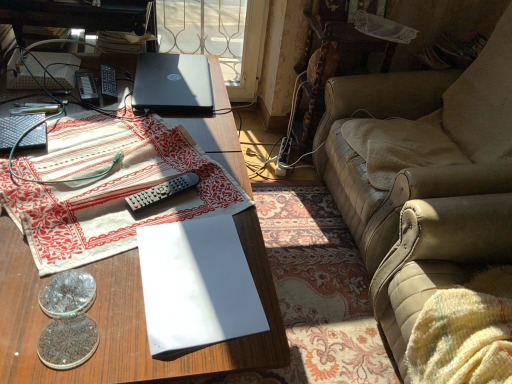
You are a GUI agent. You are given a task and a screenshot of the screen. Output one action in this format:
    pyautogui.click(x=<x>, y=<y>)
    Task: Click on the vacant region under white paper at center, marked as the first paperback book in a front-to-back arrangement (from a real-world perspective)
    This screenshot has height=384, width=512.
    Given the screenshot: What is the action you would take?
    click(200, 274)